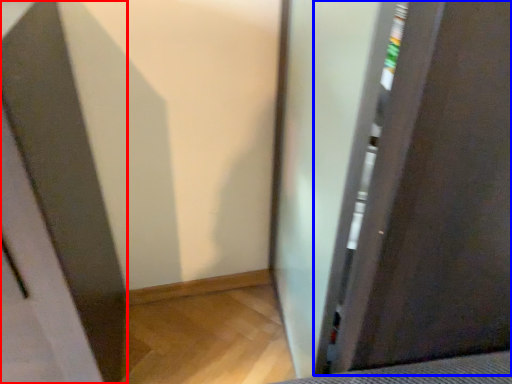
Question: Which object is further to the camera taking this photo, screen door (highlighted by a red box) or screen door (highlighted by a blue box)?

Choices:
 (A) screen door
 (B) screen door

Answer: (B)